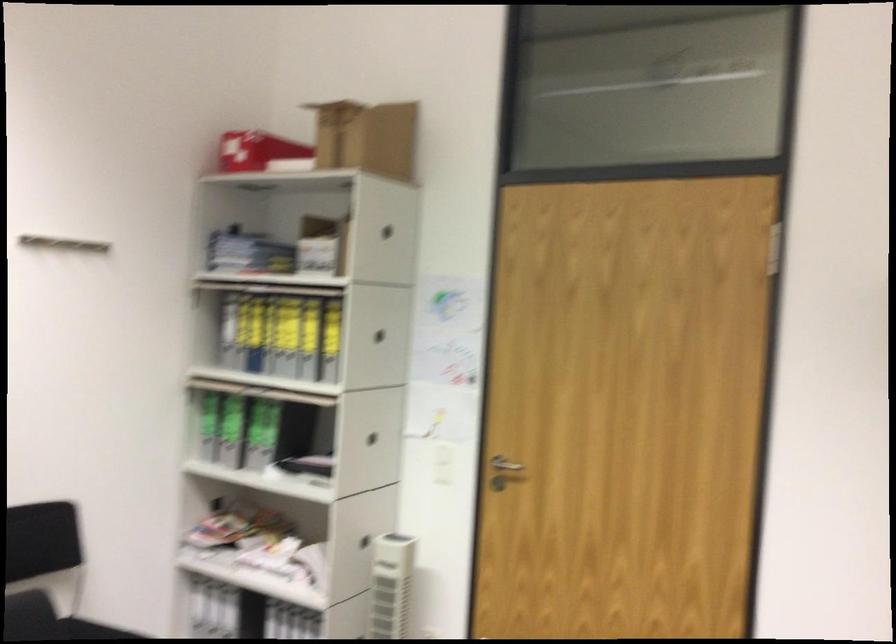
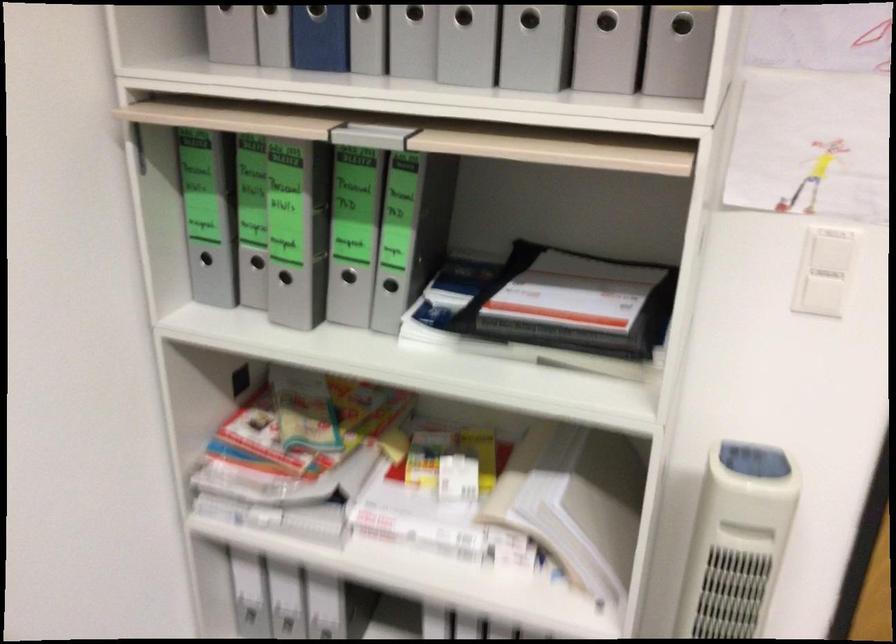
Find the pixel in the second image that matches point (453, 453) in the first image.

(831, 252)